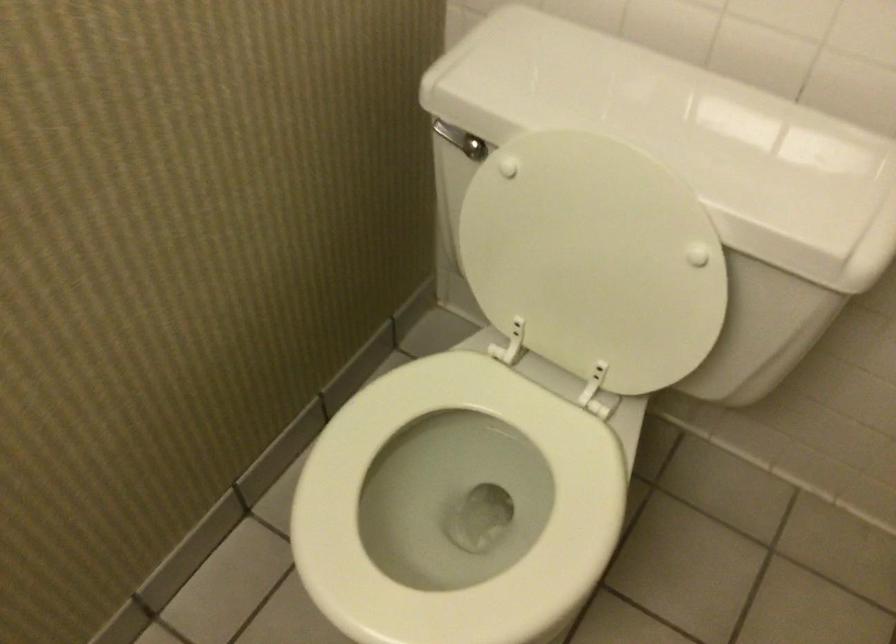
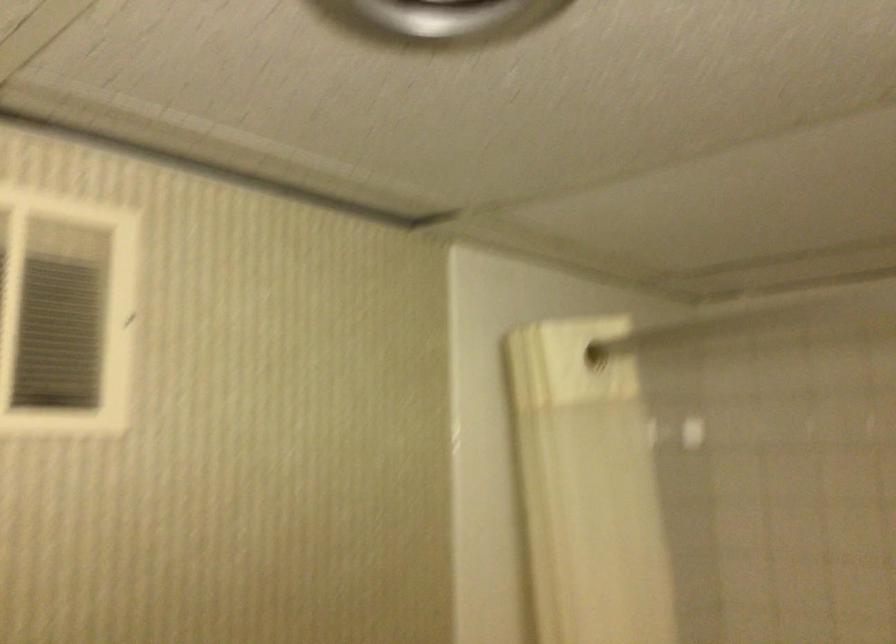
Question: The camera is either moving clockwise (left) or counter-clockwise (right) around the object. The first image is from the beginning of the video and the second image is from the end. Is the camera moving left or right when shooting the video?

Choices:
 (A) Left
 (B) Right

Answer: (A)